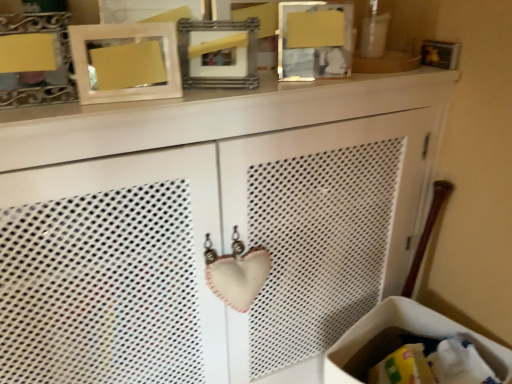
Question: Is matte white picture frame at upper center, the second picture frame positioned from the left, positioned in front of metallic silver picture frame at upper center, placed as the third picture frame when sorted from left to right?

Choices:
 (A) yes
 (B) no

Answer: (A)

Question: Is matte white picture frame at upper center, marked as the 3th picture frame in a right-to-left arrangement, with metallic silver picture frame at upper center, acting as the second picture frame starting from the right?

Choices:
 (A) no
 (B) yes

Answer: (A)

Question: Considering the relative sizes of matte white picture frame at upper center, the second picture frame positioned from the left, and metallic silver picture frame at upper center, acting as the second picture frame starting from the right, in the image provided, is matte white picture frame at upper center, the second picture frame positioned from the left, wider than metallic silver picture frame at upper center, acting as the second picture frame starting from the right,?

Choices:
 (A) no
 (B) yes

Answer: (A)

Question: From the image's perspective, does matte white picture frame at upper center, marked as the 3th picture frame in a right-to-left arrangement, appear lower than metallic silver picture frame at upper center, acting as the second picture frame starting from the right?

Choices:
 (A) yes
 (B) no

Answer: (A)

Question: Can we say matte white picture frame at upper center, marked as the 3th picture frame in a right-to-left arrangement, lies outside metallic silver picture frame at upper center, placed as the third picture frame when sorted from left to right?

Choices:
 (A) no
 (B) yes

Answer: (B)

Question: From the image's perspective, relative to matte silver picture frame at upper left, acting as the 4th picture frame starting from the right, is white fabric laundry basket at lower right above or below?

Choices:
 (A) above
 (B) below

Answer: (B)

Question: In terms of height, does white fabric laundry basket at lower right look taller or shorter compared to matte silver picture frame at upper left, acting as the 4th picture frame starting from the right?

Choices:
 (A) short
 (B) tall

Answer: (B)

Question: Relative to matte silver picture frame at upper left, acting as the 4th picture frame starting from the right, is white fabric laundry basket at lower right in front or behind?

Choices:
 (A) behind
 (B) front

Answer: (A)

Question: Is point (365, 357) positioned closer to the camera than point (64, 49)?

Choices:
 (A) closer
 (B) farther

Answer: (B)

Question: Considering the positions of wooden picture frame at upper center, which is the fourth picture frame from left to right, and matte white picture frame at upper center, the second picture frame positioned from the left, in the image, is wooden picture frame at upper center, which is the fourth picture frame from left to right, wider or thinner than matte white picture frame at upper center, the second picture frame positioned from the left,?

Choices:
 (A) wide
 (B) thin

Answer: (A)

Question: Considering the positions of wooden picture frame at upper center, the 1th picture frame positioned from the right, and matte white picture frame at upper center, the second picture frame positioned from the left, in the image, is wooden picture frame at upper center, the 1th picture frame positioned from the right, taller or shorter than matte white picture frame at upper center, the second picture frame positioned from the left,?

Choices:
 (A) short
 (B) tall

Answer: (B)

Question: From the image's perspective, relative to matte white picture frame at upper center, the second picture frame positioned from the left, is wooden picture frame at upper center, which is the fourth picture frame from left to right, above or below?

Choices:
 (A) below
 (B) above

Answer: (B)

Question: In the image, is wooden picture frame at upper center, which is the fourth picture frame from left to right, positioned in front of or behind matte white picture frame at upper center, the second picture frame positioned from the left?

Choices:
 (A) front
 (B) behind

Answer: (B)

Question: From the image's perspective, is matte white picture frame at upper center, the second picture frame positioned from the left, above or below matte silver picture frame at upper left, acting as the 4th picture frame starting from the right?

Choices:
 (A) above
 (B) below

Answer: (B)

Question: Is matte white picture frame at upper center, marked as the 3th picture frame in a right-to-left arrangement, to the left or to the right of matte silver picture frame at upper left, acting as the 4th picture frame starting from the right, in the image?

Choices:
 (A) right
 (B) left

Answer: (A)